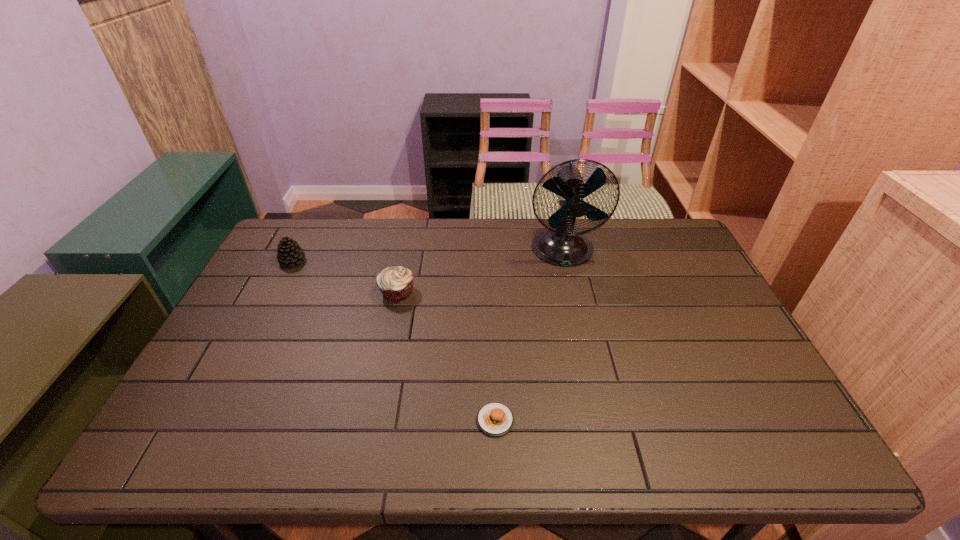
Identify the location of fan. (561, 246).

At what (x,y) coordinates should I click in order to perform the action: click on the tallest object. Please return your answer as a coordinate pair (x, y). This screenshot has height=540, width=960. Looking at the image, I should click on (561, 246).

Find the location of a particular element. The width and height of the screenshot is (960, 540). pinecone is located at coordinates (290, 253).

Locate an element on the screen. This screenshot has height=540, width=960. the second nearest object is located at coordinates (396, 283).

The image size is (960, 540). What are the coordinates of `muffin` in the screenshot? It's located at (396, 283).

Where is `food`? food is located at coordinates (494, 419).

Identify the location of the nearest object. (494, 419).

This screenshot has height=540, width=960. I want to click on vacant region located 0.270m on the front-facing side of the rightmost object, so click(x=584, y=339).

Locate an element on the screen. free region located at the narrow end of the pinecone is located at coordinates pos(367,261).

The width and height of the screenshot is (960, 540). Find the location of `vacant space located on the left of the muffin`. vacant space located on the left of the muffin is located at coordinates (355, 292).